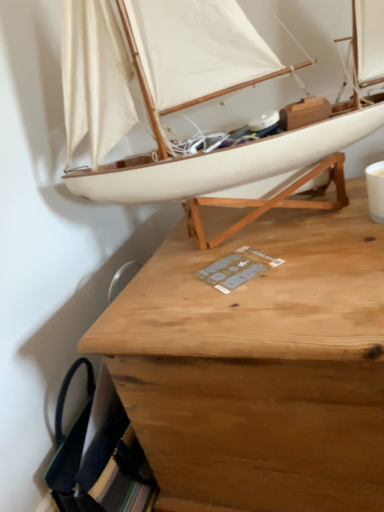
Image resolution: width=384 pixels, height=512 pixels. I want to click on vacant space underneath white matte sailboat at upper center (from a real-world perspective), so click(266, 223).